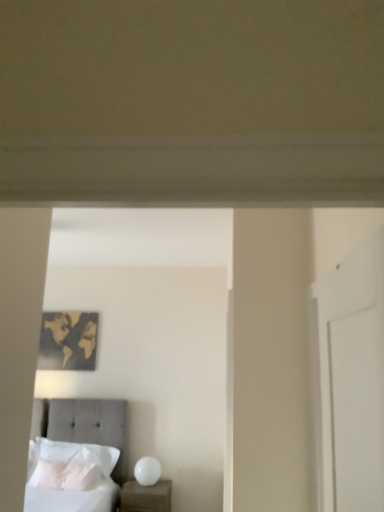
This screenshot has width=384, height=512. Describe the element at coordinates (68, 341) in the screenshot. I see `gold metallic world map at upper left` at that location.

The height and width of the screenshot is (512, 384). Find the location of `white soft pillow at lower left, the first pillow positioned from the back`. white soft pillow at lower left, the first pillow positioned from the back is located at coordinates (69, 464).

Image resolution: width=384 pixels, height=512 pixels. What are the coordinates of `white glossy nightstand at lower center` in the screenshot? It's located at (146, 497).

From a real-world perspective, is white glossy nightstand at lower center positioned above or below white soft pillow at lower left, which is the 1th pillow in front-to-back order?

white glossy nightstand at lower center is below white soft pillow at lower left, which is the 1th pillow in front-to-back order.

Is white glossy nightstand at lower center positioned in front of white soft pillow at lower left, which is the 1th pillow in front-to-back order?

Yes, white glossy nightstand at lower center is closer to the viewer.

Is white glossy nightstand at lower center thinner than white soft pillow at lower left, which is the 1th pillow in front-to-back order?

Incorrect, the width of white glossy nightstand at lower center is not less than that of white soft pillow at lower left, which is the 1th pillow in front-to-back order.

Considering the relative sizes of white glossy nightstand at lower center and white soft pillow at lower left, which is the 2th pillow in back-to-front order, in the image provided, is white glossy nightstand at lower center taller than white soft pillow at lower left, which is the 2th pillow in back-to-front order,?

Yes.

Does gold metallic world map at upper left have a greater height compared to white glossy nightstand at lower center?

Indeed, gold metallic world map at upper left has a greater height compared to white glossy nightstand at lower center.

From the image's perspective, is gold metallic world map at upper left above or below white glossy nightstand at lower center?

gold metallic world map at upper left is above white glossy nightstand at lower center.

Which of these two, gold metallic world map at upper left or white glossy nightstand at lower center, is smaller?

With smaller size is gold metallic world map at upper left.

Is gold metallic world map at upper left positioned beyond the bounds of white glossy nightstand at lower center?

Absolutely, gold metallic world map at upper left is external to white glossy nightstand at lower center.

Is white soft pillow at lower left, which ranks as the 2th pillow in front-to-back order, facing away from gold metallic world map at upper left?

No, gold metallic world map at upper left is not at the back of white soft pillow at lower left, which ranks as the 2th pillow in front-to-back order.

Is white soft pillow at lower left, the first pillow positioned from the back, behind gold metallic world map at upper left?

No, it is in front of gold metallic world map at upper left.

Which object is positioned more to the left, white soft pillow at lower left, which ranks as the 2th pillow in front-to-back order, or gold metallic world map at upper left?

Positioned to the left is gold metallic world map at upper left.

Between white soft pillow at lower left, which ranks as the 2th pillow in front-to-back order, and gold metallic world map at upper left, which one has smaller width?

Thinner between the two is gold metallic world map at upper left.

Is white soft pillow at lower left, which ranks as the 2th pillow in front-to-back order, oriented away from white soft pillow at lower left, which is the 2th pillow in back-to-front order?

Yes, white soft pillow at lower left, which is the 2th pillow in back-to-front order, is at the back of white soft pillow at lower left, which ranks as the 2th pillow in front-to-back order.

From a real-world perspective, is white soft pillow at lower left, the first pillow positioned from the back, positioned above or below white soft pillow at lower left, which is the 1th pillow in front-to-back order?

In terms of real-world spatial position, white soft pillow at lower left, the first pillow positioned from the back, is above white soft pillow at lower left, which is the 1th pillow in front-to-back order.

Can you confirm if white soft pillow at lower left, the first pillow positioned from the back, is bigger than white soft pillow at lower left, which is the 2th pillow in back-to-front order?

Yes.

Are white soft pillow at lower left, which ranks as the 2th pillow in front-to-back order, and white soft pillow at lower left, which is the 2th pillow in back-to-front order, located far from each other?

No, white soft pillow at lower left, which ranks as the 2th pillow in front-to-back order, is in close proximity to white soft pillow at lower left, which is the 2th pillow in back-to-front order.

Does point (63, 462) appear closer or farther from the camera than point (104, 418)?

Point (63, 462) is positioned closer to the camera compared to point (104, 418).

Is white soft pillow at lower left, which ranks as the 2th pillow in front-to-back order, to the left or to the right of tufted fabric bed at lower left in the image?

white soft pillow at lower left, which ranks as the 2th pillow in front-to-back order, is positioned on tufted fabric bed at lower left's right side.

Is white soft pillow at lower left, which ranks as the 2th pillow in front-to-back order, oriented away from tufted fabric bed at lower left?

That's right, white soft pillow at lower left, which ranks as the 2th pillow in front-to-back order, is facing away from tufted fabric bed at lower left.

Between tufted fabric bed at lower left and white glossy nightstand at lower center, which one is positioned in front?

tufted fabric bed at lower left is more forward.

From the image's perspective, between tufted fabric bed at lower left and white glossy nightstand at lower center, who is located below?

white glossy nightstand at lower center is shown below in the image.

Is tufted fabric bed at lower left turned away from white glossy nightstand at lower center?

tufted fabric bed at lower left is not turned away from white glossy nightstand at lower center.

Is white glossy nightstand at lower center located within tufted fabric bed at lower left?

No, white glossy nightstand at lower center is not inside tufted fabric bed at lower left.

Locate an element on the screen. bed that is above the white soft pillow at lower left, which is the 1th pillow in front-to-back order (from a real-world perspective) is located at coordinates (78, 457).

Is tufted fabric bed at lower left positioned behind white soft pillow at lower left, which is the 1th pillow in front-to-back order?

No, it is in front of white soft pillow at lower left, which is the 1th pillow in front-to-back order.

Is white soft pillow at lower left, which is the 1th pillow in front-to-back order, at the back of tufted fabric bed at lower left?

Correct, tufted fabric bed at lower left is looking away from white soft pillow at lower left, which is the 1th pillow in front-to-back order.

Find the location of a particular element. nightstand lying on the right of white soft pillow at lower left, which is the 1th pillow in front-to-back order is located at coordinates (146, 497).

The image size is (384, 512). Identify the location of picture frame that is behind the white glossy nightstand at lower center. (68, 341).

From the image, which object appears to be nearer to gold metallic world map at upper left, tufted fabric bed at lower left or white glossy nightstand at lower center?

tufted fabric bed at lower left lies closer to gold metallic world map at upper left than the other object.

When comparing their distances from tufted fabric bed at lower left, does white glossy nightstand at lower center or gold metallic world map at upper left seem further?

gold metallic world map at upper left is further to tufted fabric bed at lower left.

Looking at this image, estimate the real-world distances between objects in this image. Which object is closer to tufted fabric bed at lower left, gold metallic world map at upper left or white glossy nightstand at lower center?

white glossy nightstand at lower center is positioned closer to the anchor tufted fabric bed at lower left.

When comparing their distances from white glossy nightstand at lower center, does white soft pillow at lower left, which is the 2th pillow in back-to-front order, or white soft pillow at lower left, the first pillow positioned from the back, seem closer?

white soft pillow at lower left, which is the 2th pillow in back-to-front order, lies closer to white glossy nightstand at lower center than the other object.

Based on their spatial positions, is gold metallic world map at upper left or white soft pillow at lower left, which ranks as the 2th pillow in front-to-back order, closer to white soft pillow at lower left, which is the 1th pillow in front-to-back order?

The object closer to white soft pillow at lower left, which is the 1th pillow in front-to-back order, is white soft pillow at lower left, which ranks as the 2th pillow in front-to-back order.

Consider the image. Estimate the real-world distances between objects in this image. Which object is closer to white soft pillow at lower left, which is the 1th pillow in front-to-back order, tufted fabric bed at lower left or gold metallic world map at upper left?

tufted fabric bed at lower left.

When comparing their distances from gold metallic world map at upper left, does white glossy nightstand at lower center or tufted fabric bed at lower left seem further?

The object further to gold metallic world map at upper left is white glossy nightstand at lower center.

Looking at the image, which one is located closer to tufted fabric bed at lower left, white soft pillow at lower left, which ranks as the 2th pillow in front-to-back order, or gold metallic world map at upper left?

white soft pillow at lower left, which ranks as the 2th pillow in front-to-back order, is positioned closer to the anchor tufted fabric bed at lower left.

Where is `pillow between tufted fabric bed at lower left and white soft pillow at lower left, the first pillow positioned from the back, along the z-axis`? This screenshot has width=384, height=512. pillow between tufted fabric bed at lower left and white soft pillow at lower left, the first pillow positioned from the back, along the z-axis is located at coordinates (66, 475).

You are a GUI agent. You are given a task and a screenshot of the screen. Output one action in this format:
    pyautogui.click(x=<x>, y=<y>)
    Task: Click on the nightstand located between tufted fabric bed at lower left and white soft pillow at lower left, which is the 1th pillow in front-to-back order, in the depth direction
    
    Given the screenshot: What is the action you would take?
    pyautogui.click(x=146, y=497)

Where is `pillow between gold metallic world map at upper left and white soft pillow at lower left, which is the 1th pillow in front-to-back order, in the up-down direction`? The height and width of the screenshot is (512, 384). pillow between gold metallic world map at upper left and white soft pillow at lower left, which is the 1th pillow in front-to-back order, in the up-down direction is located at coordinates (69, 464).

The image size is (384, 512). I want to click on pillow between white soft pillow at lower left, which is the 2th pillow in back-to-front order, and white glossy nightstand at lower center from left to right, so click(x=69, y=464).